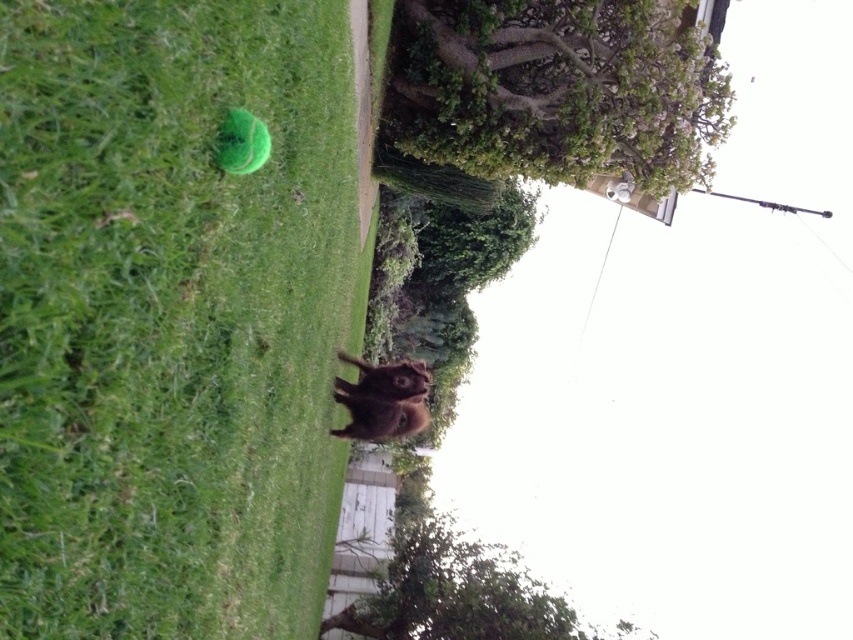
Question: Estimate the real-world distances between objects in this image. Which object is farther from the green leafy tree at upper center?

Choices:
 (A) green leafy tree at lower center
 (B) brown furry dog at center
 (C) green grass at lower left

Answer: (A)

Question: Which object is the farthest from the brown furry dog at center?

Choices:
 (A) green leafy tree at lower center
 (B) green leafy tree at upper center

Answer: (A)

Question: Is green leafy tree at upper center positioned before brown furry dog at center?

Choices:
 (A) yes
 (B) no

Answer: (B)

Question: Which point is closer to the camera?

Choices:
 (A) (519, 13)
 (B) (381, 387)
 (C) (334, 525)

Answer: (B)

Question: Where is green leafy tree at upper center located in relation to brown furry dog at center in the image?

Choices:
 (A) right
 (B) left

Answer: (A)

Question: Where is green leafy tree at upper center located in relation to green leafy tree at lower center in the image?

Choices:
 (A) above
 (B) below

Answer: (A)